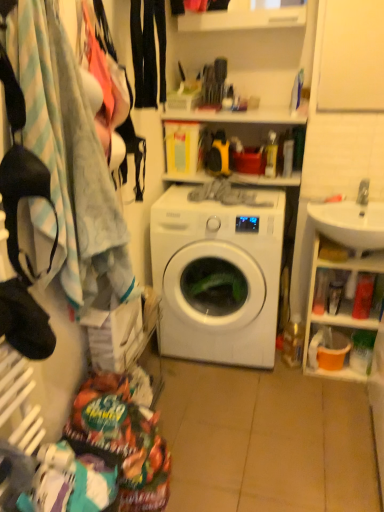
Identify the location of white glossy sink at right. (351, 221).

Find the location of a particular element. The width and height of the screenshot is (384, 512). white glossy cabinet at right is located at coordinates (339, 312).

Consider the image. Measure the distance between white glossy washing machine at center and camera.

The distance of white glossy washing machine at center from camera is 6.01 feet.

Where is `white glossy sink at right`? Image resolution: width=384 pixels, height=512 pixels. white glossy sink at right is located at coordinates (351, 221).

Does white glossy cabinet at right have a lesser height compared to white glossy washing machine at center?

Yes, white glossy cabinet at right is shorter than white glossy washing machine at center.

Is white glossy cabinet at right to the right of white glossy washing machine at center from the viewer's perspective?

Yes.

Is white glossy cabinet at right directly adjacent to white glossy washing machine at center?

white glossy cabinet at right is not next to white glossy washing machine at center, and they're not touching.

Which is behind, point (336, 316) or point (135, 102)?

The point (336, 316) is farther from the camera.

From the image's perspective, does white glossy cabinet at right appear higher than black smooth pants at upper center?

No, from the image's perspective, white glossy cabinet at right is not above black smooth pants at upper center.

Can you confirm if white glossy cabinet at right is bigger than black smooth pants at upper center?

Yes.

Identify the location of clothing that is above the white glossy washing machine at center (from the image's perspective). The image size is (384, 512). (148, 51).

Is white glossy washing machine at center in front of or behind black smooth pants at upper center in the image?

Visually, white glossy washing machine at center is located behind black smooth pants at upper center.

Is black smooth pants at upper center completely or partially inside white glossy washing machine at center?

No.

From a real-world perspective, which is physically above, white glossy washing machine at center or black smooth pants at upper center?

black smooth pants at upper center.

Is white glossy sink at right positioned beyond the bounds of white glossy cabinet at right?

Yes, white glossy sink at right is located beyond the bounds of white glossy cabinet at right.

Who is shorter, white glossy sink at right or white glossy cabinet at right?

Standing shorter between the two is white glossy sink at right.

Looking at this image, from the image's perspective, is white glossy sink at right located above or below white glossy cabinet at right?

From the image's perspective, white glossy sink at right appears above white glossy cabinet at right.

From a real-world perspective, is white glossy sink at right under white glossy cabinet at right?

No, from a real-world perspective, white glossy sink at right is not under white glossy cabinet at right.

Based on the photo, which of these two, black smooth pants at upper center or white glossy cabinet at right, stands shorter?

With less height is black smooth pants at upper center.

The image size is (384, 512). Identify the location of clothing in front of the white glossy cabinet at right. (148, 51).

In the image, is black smooth pants at upper center positioned in front of or behind white glossy cabinet at right?

black smooth pants at upper center is in front of white glossy cabinet at right.

Which is less distant, (242, 230) or (331, 231)?

Positioned in front is point (242, 230).

Between white glossy washing machine at center and white glossy sink at right, which one has more height?

white glossy washing machine at center.

Does white glossy washing machine at center have a larger size compared to white glossy sink at right?

Correct, white glossy washing machine at center is larger in size than white glossy sink at right.

Is white glossy washing machine at center next to white glossy sink at right and touching it?

No, white glossy washing machine at center is not making contact with white glossy sink at right.

Would you say black smooth pants at upper center is to the left or to the right of white glossy sink at right in the picture?

Clearly, black smooth pants at upper center is on the left of white glossy sink at right in the image.

Would you say black smooth pants at upper center contains white glossy sink at right?

That's incorrect, white glossy sink at right is not inside black smooth pants at upper center.

Considering the positions of objects black smooth pants at upper center and white glossy sink at right in the image provided, who is in front, black smooth pants at upper center or white glossy sink at right?

black smooth pants at upper center is more forward.

From the image's perspective, would you say black smooth pants at upper center is shown under white glossy sink at right?

No.

Image resolution: width=384 pixels, height=512 pixels. Find the location of `cabinet on the right side of white glossy washing machine at center`. cabinet on the right side of white glossy washing machine at center is located at coordinates (339, 312).

You are a GUI agent. You are given a task and a screenshot of the screen. Output one action in this format:
    pyautogui.click(x=<x>, y=<y>)
    Task: Click on the clothing on the left of white glossy cabinet at right
    This screenshot has width=384, height=512.
    Given the screenshot: What is the action you would take?
    click(148, 51)

When comparing their distances from white glossy sink at right, does black smooth pants at upper center or white glossy cabinet at right seem closer?

The object closer to white glossy sink at right is white glossy cabinet at right.

Which object lies nearer to the anchor point white glossy washing machine at center, white glossy sink at right or black smooth pants at upper center?

white glossy sink at right.

From the image, which object appears to be nearer to white glossy washing machine at center, white glossy sink at right or white glossy cabinet at right?

white glossy cabinet at right lies closer to white glossy washing machine at center than the other object.

Which object lies further to the anchor point white glossy cabinet at right, black smooth pants at upper center or white glossy washing machine at center?

black smooth pants at upper center is further to white glossy cabinet at right.

From the picture: When comparing their distances from black smooth pants at upper center, does white glossy sink at right or white glossy washing machine at center seem closer?

Based on the image, white glossy washing machine at center appears to be nearer to black smooth pants at upper center.

From the image, which object appears to be nearer to black smooth pants at upper center, white glossy washing machine at center or white glossy sink at right?

white glossy washing machine at center.

Looking at the image, which one is located further to white glossy sink at right, white glossy cabinet at right or white glossy washing machine at center?

Based on the image, white glossy washing machine at center appears to be further to white glossy sink at right.

Which object lies further to the anchor point white glossy washing machine at center, white glossy cabinet at right or black smooth pants at upper center?

black smooth pants at upper center.

I want to click on washing machine situated between black smooth pants at upper center and white glossy sink at right from left to right, so click(x=218, y=275).

You are a GUI agent. You are given a task and a screenshot of the screen. Output one action in this format:
    pyautogui.click(x=<x>, y=<y>)
    Task: Click on the washing machine between black smooth pants at upper center and white glossy cabinet at right in the vertical direction
    Image resolution: width=384 pixels, height=512 pixels.
    Given the screenshot: What is the action you would take?
    pyautogui.click(x=218, y=275)

At what (x,y) coordinates should I click in order to perform the action: click on sink between black smooth pants at upper center and white glossy cabinet at right from left to right. Please return your answer as a coordinate pair (x, y). Looking at the image, I should click on (351, 221).

Where is `sink situated between white glossy washing machine at center and white glossy cabinet at right from left to right`? sink situated between white glossy washing machine at center and white glossy cabinet at right from left to right is located at coordinates (351, 221).